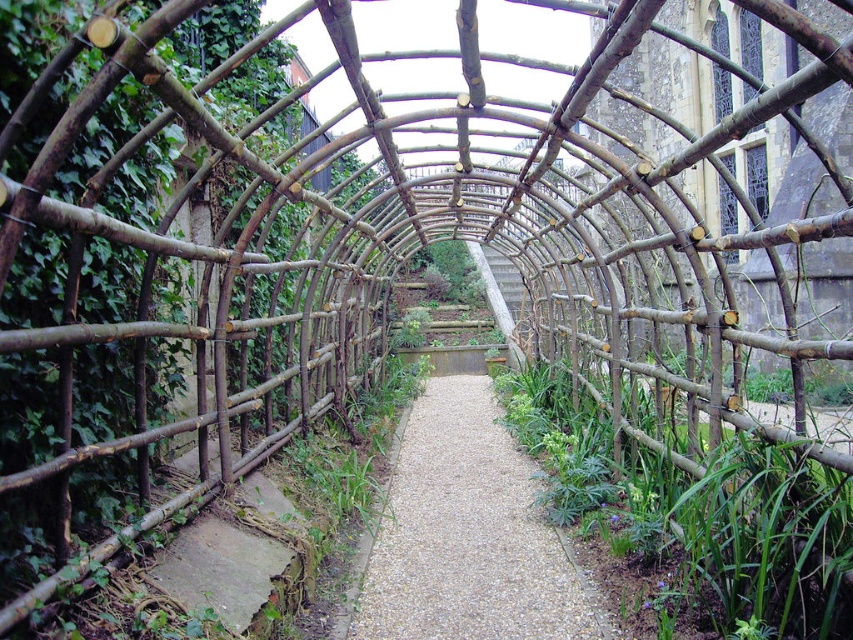
Question: Among these points, which one is nearest to the camera?

Choices:
 (A) (456, 620)
 (B) (247, 368)

Answer: (A)

Question: Which point is closer to the camera?

Choices:
 (A) gravelly stone path at center
 (B) natural wood trellis at left

Answer: (B)

Question: Does natural wood trellis at left have a larger size compared to green leafy plant at center?

Choices:
 (A) yes
 (B) no

Answer: (A)

Question: Is natural wood trellis at left below gravelly stone path at center?

Choices:
 (A) yes
 (B) no

Answer: (B)

Question: Where is natural wood trellis at left located in relation to green leafy plant at center in the image?

Choices:
 (A) above
 (B) below

Answer: (A)

Question: Which point is closer to the camera?

Choices:
 (A) natural wood trellis at left
 (B) gravelly stone path at center
 (C) green leafy plant at center

Answer: (A)